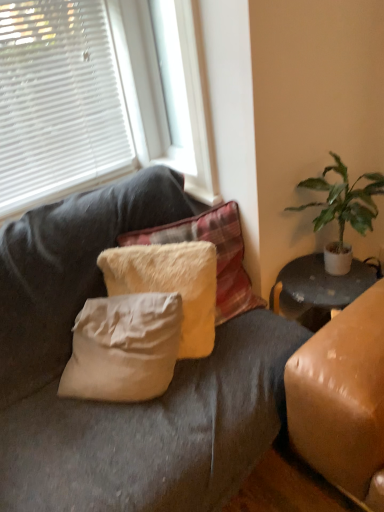
Question: Is white plastic window frame at upper center not close to fuzzy white pillow at center, the 1th pillow positioned from the bottom?

Choices:
 (A) no
 (B) yes

Answer: (A)

Question: Is white plastic window frame at upper center wider than fuzzy white pillow at center, acting as the second pillow starting from the top?

Choices:
 (A) no
 (B) yes

Answer: (A)

Question: Is white plastic window frame at upper center positioned beyond the bounds of fuzzy white pillow at center, acting as the second pillow starting from the top?

Choices:
 (A) yes
 (B) no

Answer: (A)

Question: Considering the relative positions of white plastic window frame at upper center and fuzzy white pillow at center, acting as the second pillow starting from the top, in the image provided, is white plastic window frame at upper center to the right of fuzzy white pillow at center, acting as the second pillow starting from the top, from the viewer's perspective?

Choices:
 (A) no
 (B) yes

Answer: (B)

Question: From a real-world perspective, is white plastic window frame at upper center beneath fuzzy white pillow at center, the 1th pillow positioned from the bottom?

Choices:
 (A) no
 (B) yes

Answer: (A)

Question: Looking at their shapes, would you say fuzzy white pillow at center, acting as the 1th pillow starting from the top, is wider or thinner than white plastic window frame at upper center?

Choices:
 (A) thin
 (B) wide

Answer: (B)

Question: Considering the positions of fuzzy white pillow at center, acting as the 1th pillow starting from the top, and white plastic window frame at upper center in the image, is fuzzy white pillow at center, acting as the 1th pillow starting from the top, bigger or smaller than white plastic window frame at upper center?

Choices:
 (A) small
 (B) big

Answer: (B)

Question: From a real-world perspective, relative to white plastic window frame at upper center, is fuzzy white pillow at center, acting as the 1th pillow starting from the top, vertically above or below?

Choices:
 (A) below
 (B) above

Answer: (A)

Question: In terms of height, does fuzzy white pillow at center, marked as the 2th pillow in a bottom-to-top arrangement, look taller or shorter compared to white plastic window frame at upper center?

Choices:
 (A) short
 (B) tall

Answer: (A)

Question: Is white blinds at upper left in front of or behind white plastic window frame at upper center in the image?

Choices:
 (A) front
 (B) behind

Answer: (A)

Question: Looking at their shapes, would you say white blinds at upper left is wider or thinner than white plastic window frame at upper center?

Choices:
 (A) wide
 (B) thin

Answer: (B)

Question: Based on their sizes in the image, would you say white blinds at upper left is bigger or smaller than white plastic window frame at upper center?

Choices:
 (A) big
 (B) small

Answer: (A)

Question: Would you say white blinds at upper left is to the left or to the right of white plastic window frame at upper center in the picture?

Choices:
 (A) left
 (B) right

Answer: (A)

Question: From the image's perspective, is fuzzy white pillow at center, the 1th pillow positioned from the bottom, positioned above or below white plastic window frame at upper center?

Choices:
 (A) below
 (B) above

Answer: (A)

Question: In the image, is fuzzy white pillow at center, the 1th pillow positioned from the bottom, positioned in front of or behind white plastic window frame at upper center?

Choices:
 (A) front
 (B) behind

Answer: (A)